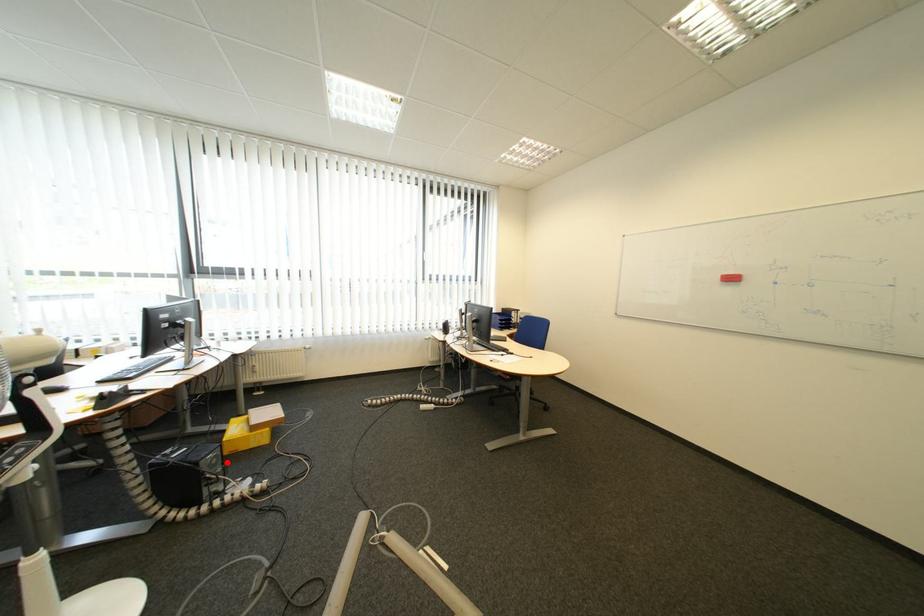
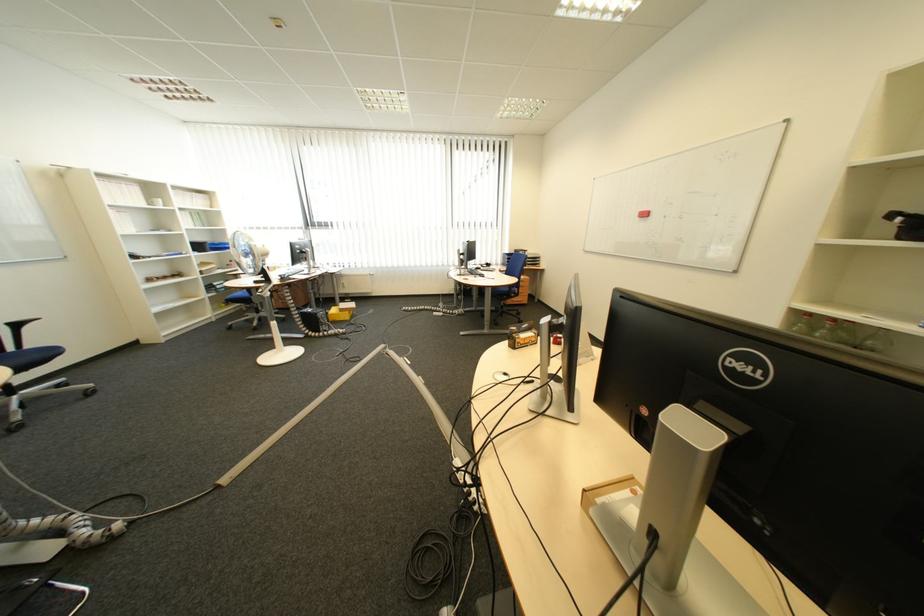
Locate, in the second image, the point that corresponds to the highlighted location in the first image.

(335, 317)